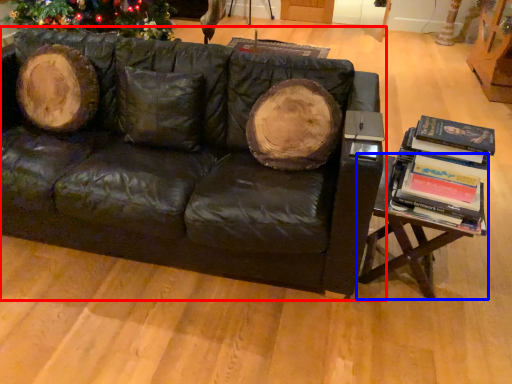
Question: Which object appears farthest to the camera in this image, studio couch (highlighted by a red box) or table (highlighted by a blue box)?

Choices:
 (A) studio couch
 (B) table

Answer: (B)